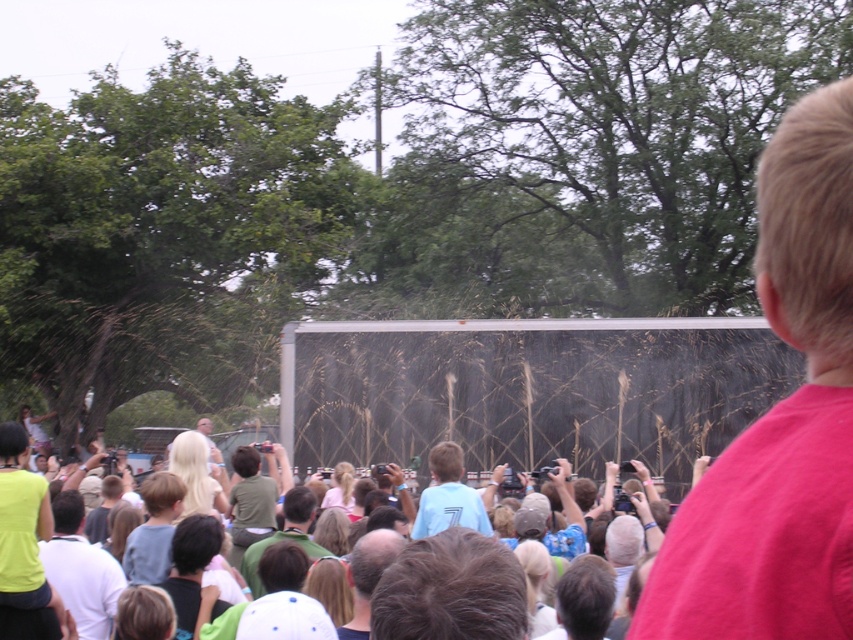
You are standing in the crowd at the event and notice two people in front of you. One has dark brown hair at center and the other is wearing a neon yellow shirt at lower left. Which person is closer to you?

The neon yellow shirt at lower left is closer to you because the dark brown hair at center is located above it, meaning the person with the neon yellow shirt is in front.

You are a photographer trying to capture the crowd and the screen. You notice two people in the crowd wearing shirts of different colors. The pink cotton shirt at right and the green fabric shirt at center. Which shirt appears narrower in the photo?

The pink cotton shirt at right has a lesser width compared to the green fabric shirt at center, so it appears narrower in the photo.